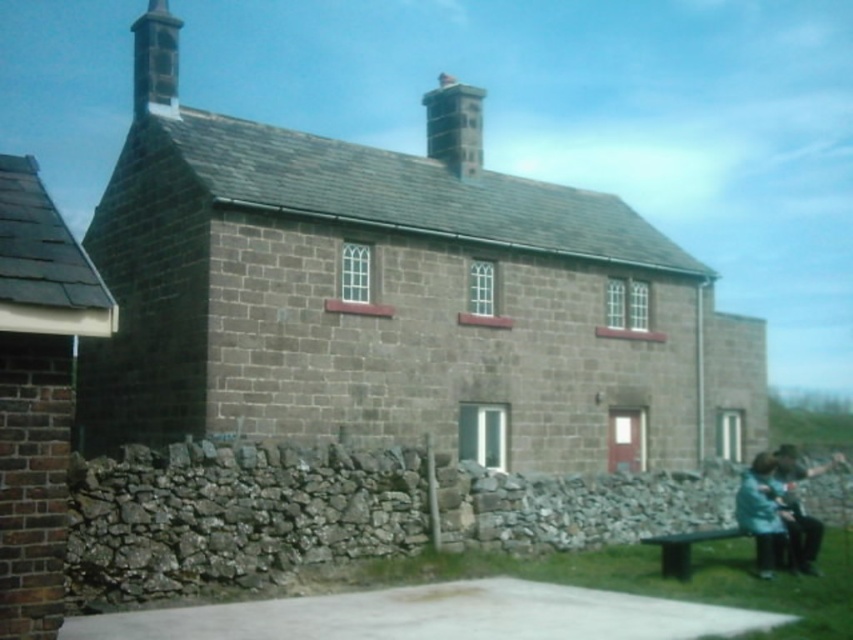
Question: Is smooth stone chimney at upper left below blue fabric at lower right?

Choices:
 (A) yes
 (B) no

Answer: (B)

Question: Which object is farther from the camera taking this photo?

Choices:
 (A) smooth gray chimney at upper center
 (B) blue fabric at lower right

Answer: (A)

Question: Is smooth gray chimney at upper center bigger than blue-green fabric jacket at lower right?

Choices:
 (A) yes
 (B) no

Answer: (A)

Question: Which point appears farthest from the camera in this image?

Choices:
 (A) (796, 568)
 (B) (428, 106)

Answer: (B)

Question: Considering the real-world distances, which object is farthest from the smooth stone chimney at upper left?

Choices:
 (A) smooth gray chimney at upper center
 (B) green wooden bench at lower right
 (C) blue fabric at lower right
 (D) blue-green fabric jacket at lower right

Answer: (B)

Question: Is smooth stone chimney at upper left to the right of green wooden bench at lower right from the viewer's perspective?

Choices:
 (A) yes
 (B) no

Answer: (B)